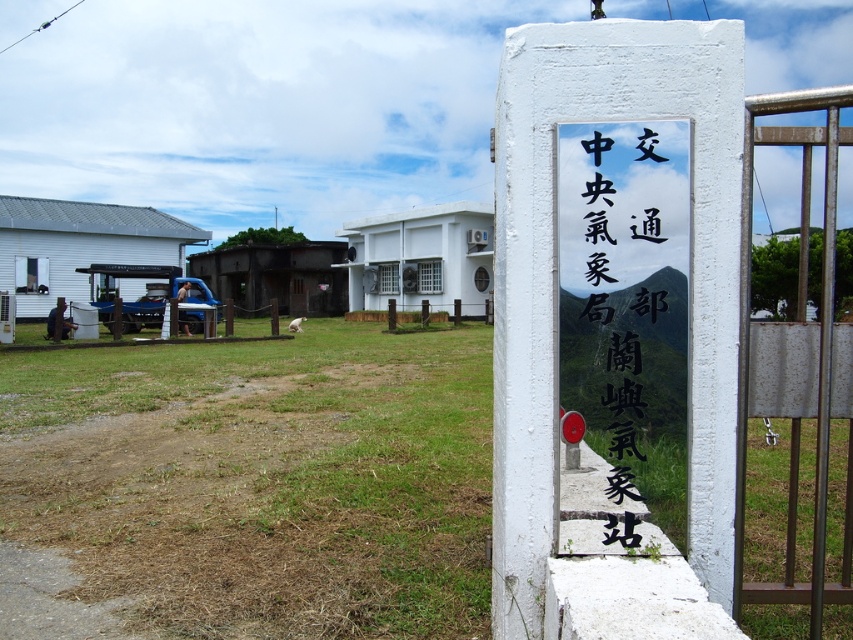
You are a visitor arriving at the weather station and need to find the entrance. You see the white stone sign at center and the brown metal gate at right. Which object is larger in size?

The brown metal gate at right is larger in size compared to the white stone sign at center.

You are standing in front of a weather station and want to enter through the brown metal gate at right. To do so, you need to first read the information on the white stone sign at center. Which object should you interact with first based on their positions?

The white stone sign at center is closer to the viewer than the brown metal gate at right, so you should interact with the white stone sign at center first before proceeding to the brown metal gate at right.

You are standing in front of the weather station pillar and want to touch both the point at coordinates point (671, 332) and point (833, 196). Which point should you reach for first to touch the one closer to you?

You should first touch the point (671, 332) because it is closer to you than the point (833, 196).